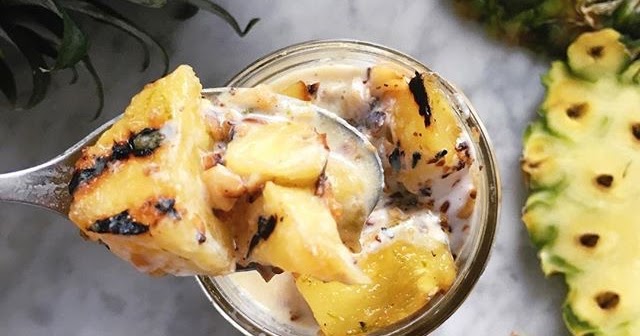
The height and width of the screenshot is (336, 640). I want to click on glass, so click(361, 45).